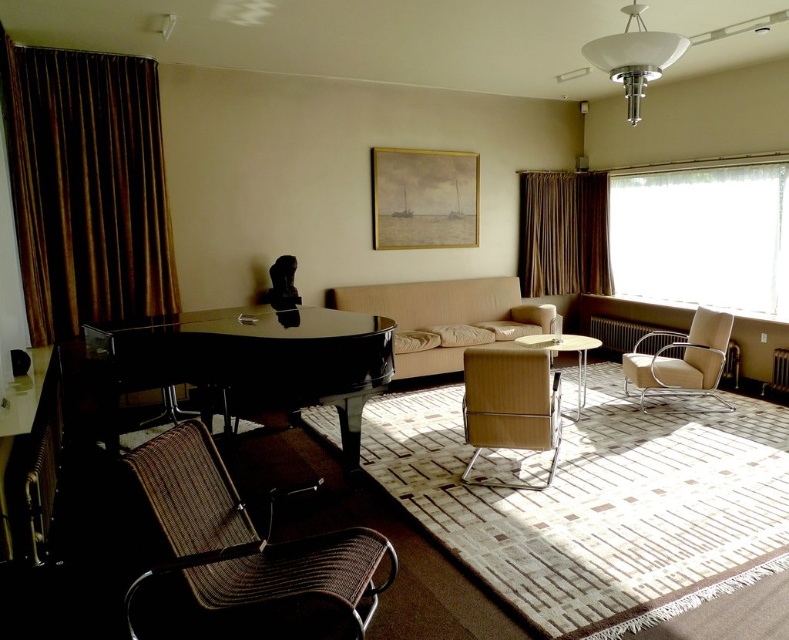
Based on the photo, you are a guest entering the living room and want to sit on the woven brown armchair at lower left. Can you see the brown velvet curtain at left from your seat?

The woven brown armchair at lower left is behind the brown velvet curtain at left, so yes, you can see the brown velvet curtain at left from your seat.

You are standing in the living room and want to move from the sofa to the piano. The sofa is near point A at point [212,582] and the piano is near point B at point [582,372]. Which point should you walk towards first to reach the piano?

You should walk towards point B at point [582,372] first because it is behind point A at point [212,582], meaning the piano is located further back in the room compared to the sofa.